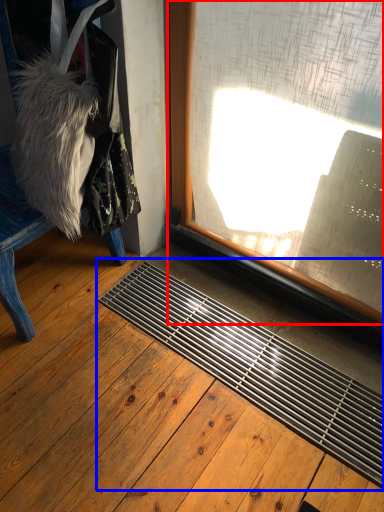
Question: Which object is closer to the camera taking this photo, window (highlighted by a red box) or doormat (highlighted by a blue box)?

Choices:
 (A) window
 (B) doormat

Answer: (B)